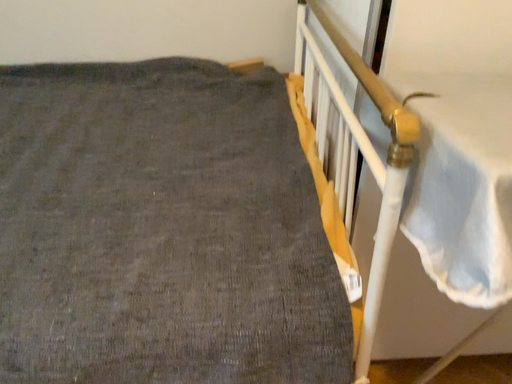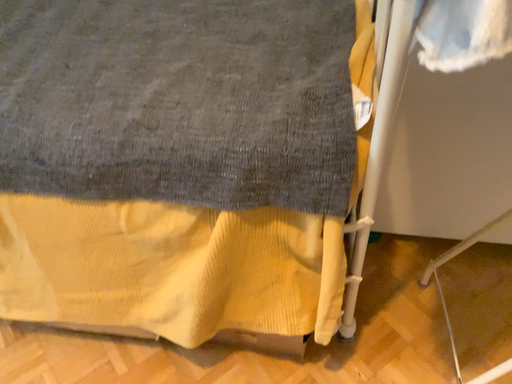
Question: Which way did the camera rotate in the video?

Choices:
 (A) rotated downward
 (B) rotated upward

Answer: (A)